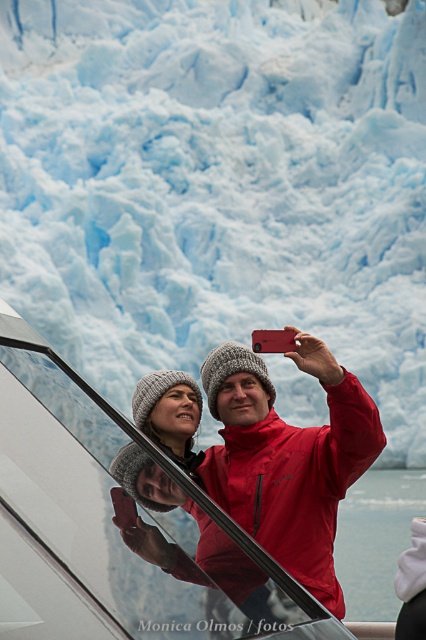
You are a photographer planning to capture the glacier and the people in the image. Based on the scene, which object, the glacial ice at upper center or the matte red jacket at center, would appear larger in the photo?

The glacial ice at upper center would appear larger in the photo because it is much taller than the matte red jacket at center.

You are a photographer planning to capture a landscape shot of the glacial ice at upper center and the matte red jacket at center. Based on their positions in the image, which object should you focus on first to ensure both are in sharp focus?

The matte red jacket at center is lower than the glacial ice at upper center, so you should focus on the matte red jacket at center first to ensure both are in sharp focus since it is closer to the camera.